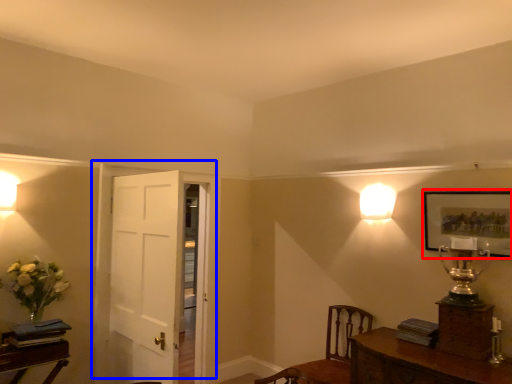
Question: Which of the following is the farthest to the observer, picture frame (highlighted by a red box) or door (highlighted by a blue box)?

Choices:
 (A) picture frame
 (B) door

Answer: (B)